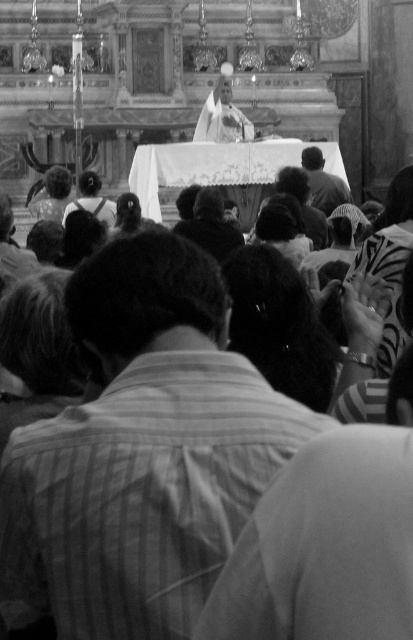
Can you confirm if striped fabric shirt at center is positioned below dark hair at upper center?

Yes, striped fabric shirt at center is below dark hair at upper center.

Is striped fabric shirt at center smaller than dark hair at upper center?

No.

Which is in front, point (78, 573) or point (308, 182)?

Point (78, 573) is more forward.

This screenshot has height=640, width=413. What are the coordinates of `striped fabric shirt at center` in the screenshot? It's located at (142, 451).